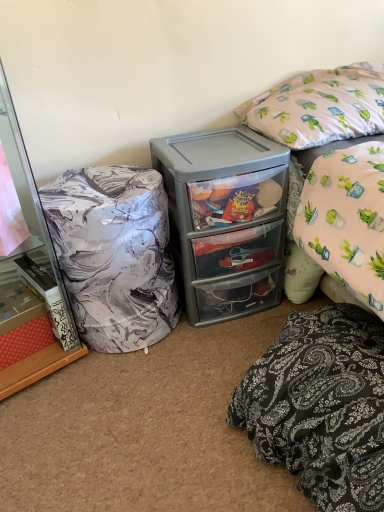
Where is `free space to the left of black paisley pillow at lower right, the 2th pillow when ordered from top to bottom`? Image resolution: width=384 pixels, height=512 pixels. free space to the left of black paisley pillow at lower right, the 2th pillow when ordered from top to bottom is located at coordinates (157, 433).